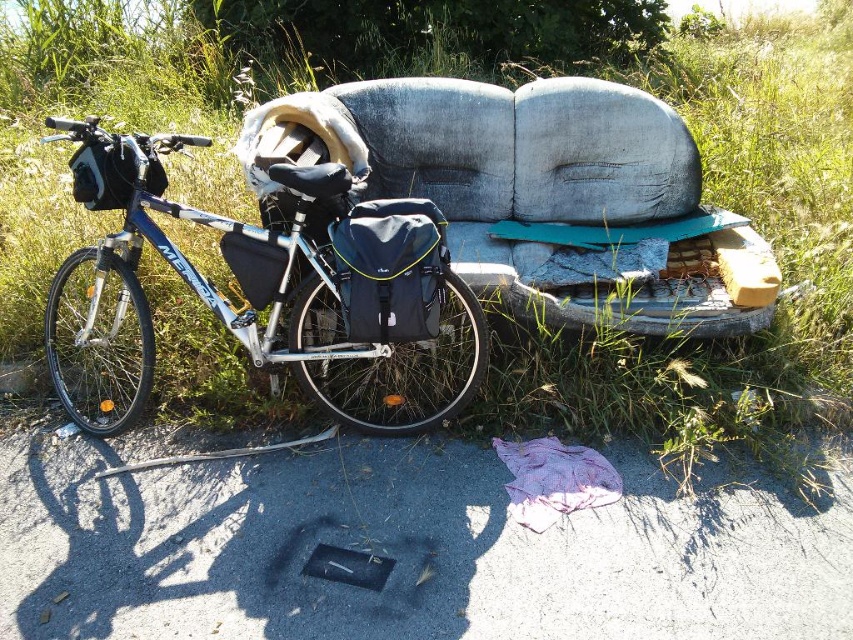
You are planning to place a small garden ornament in the scene. Considering the sizes of the green grass at upper left and the worn fabric couch at center, which area would be more suitable for placing the ornament to ensure it is visible?

The green grass at upper left is bigger than the worn fabric couch at center, so placing the ornament on the worn fabric couch at center would make it more visible since the couch is smaller and the ornament would stand out better against the larger grass area.

You are standing in the grassy area and want to take a photo of the bicycle and the sofa. You notice two specific points in the scene marked as point 1 at coordinates (466, 188) and point 2 at coordinates (57, 308). Which point is closer to your camera lens?

Point 1 at coordinates (466, 188) is closer to the camera lens because it is further to the camera than point 2 at coordinates (57, 308).